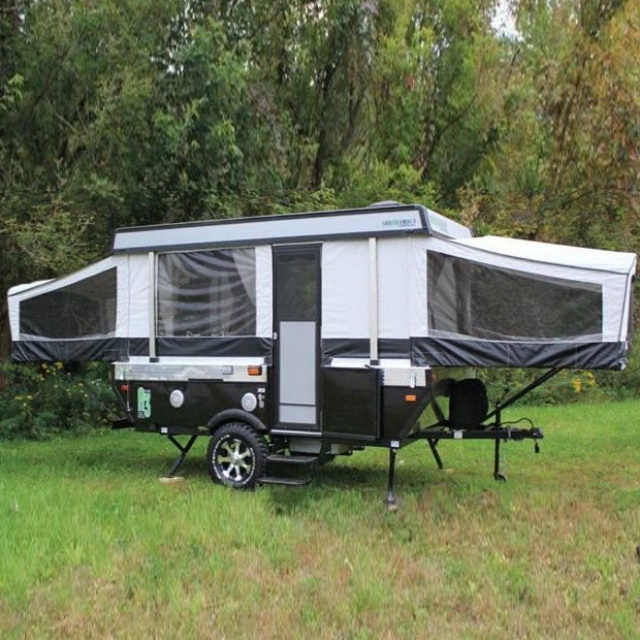
Question: Which is nearer to the green grass at center?

Choices:
 (A) black metallic wheel at lower center
 (B) black matte pop-up camper at center

Answer: (A)

Question: Considering the relative positions of black matte pop-up camper at center and black metallic wheel at lower center in the image provided, where is black matte pop-up camper at center located with respect to black metallic wheel at lower center?

Choices:
 (A) above
 (B) below

Answer: (A)

Question: Observing the image, what is the correct spatial positioning of green grass at center in reference to black metallic wheel at lower center?

Choices:
 (A) below
 (B) above

Answer: (A)

Question: Where is black matte pop-up camper at center located in relation to black metallic wheel at lower center in the image?

Choices:
 (A) right
 (B) left

Answer: (B)

Question: Which is nearer to the green grass at center?

Choices:
 (A) black metallic wheel at lower center
 (B) black matte pop-up camper at center

Answer: (A)

Question: Among these objects, which one is farthest from the camera?

Choices:
 (A) black metallic wheel at lower center
 (B) green grass at center

Answer: (A)